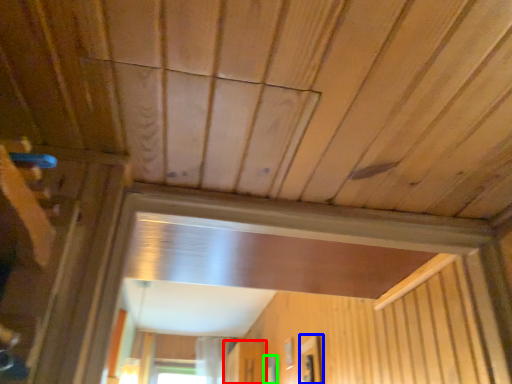
Question: Estimate the real-world distances between objects in this image. Which object is farther from screen door (highlighted by a red box), window (highlighted by a blue box) or window (highlighted by a green box)?

Choices:
 (A) window
 (B) window

Answer: (A)